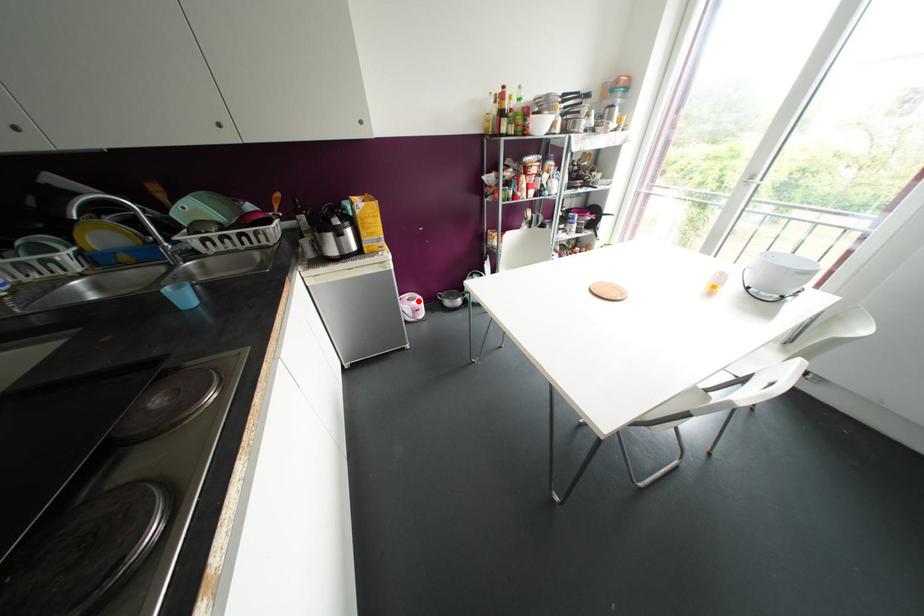
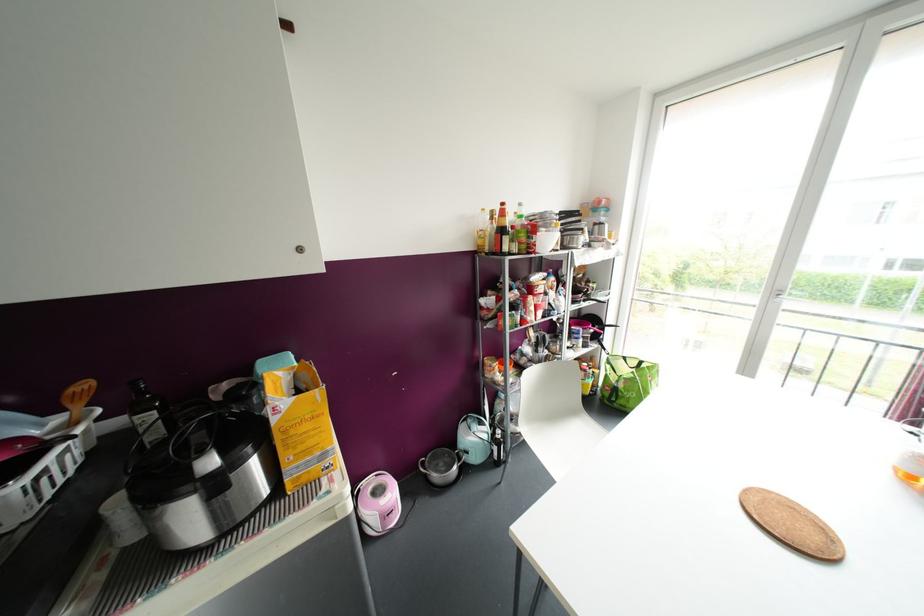
Question: I am providing you with two images of the same scene from different viewpoints. Given a red point in image1, look at the same physical point in image2. Is it:

Choices:
 (A) Closer to the viewpoint
 (B) Farther from the viewpoint

Answer: (A)